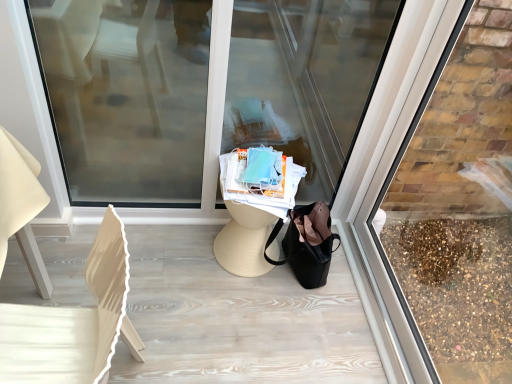
What do you see at coordinates (201, 90) in the screenshot? The image size is (512, 384). I see `transparent glass shop window at center, marked as the 1th shop window in a left-to-right arrangement` at bounding box center [201, 90].

This screenshot has width=512, height=384. What do you see at coordinates (458, 205) in the screenshot? I see `transparent glass at right, which ranks as the 2th shop window in left-to-right order` at bounding box center [458, 205].

You are a GUI agent. You are given a task and a screenshot of the screen. Output one action in this format:
    pyautogui.click(x=<x>, y=<y>)
    Task: Click on the white wood chair at left
    The height and width of the screenshot is (384, 512).
    Given the screenshot: What is the action you would take?
    73,323

This screenshot has width=512, height=384. I want to click on transparent glass shop window at center, marked as the 1th shop window in a left-to-right arrangement, so click(x=201, y=90).

Is transparent glass at right, the first shop window in the right-to-left sequence, looking in the opposite direction of transparent glass shop window at center, the second shop window positioned from the right?

No, transparent glass at right, the first shop window in the right-to-left sequence,'s orientation is not away from transparent glass shop window at center, the second shop window positioned from the right.

Who is bigger, transparent glass at right, the first shop window in the right-to-left sequence, or transparent glass shop window at center, marked as the 1th shop window in a left-to-right arrangement?

transparent glass shop window at center, marked as the 1th shop window in a left-to-right arrangement, is bigger.

Is transparent glass at right, the first shop window in the right-to-left sequence, positioned in front of transparent glass shop window at center, marked as the 1th shop window in a left-to-right arrangement?

Yes, it is.

Considering the positions of point (64, 164) and point (21, 366), is point (64, 164) closer or farther from the camera than point (21, 366)?

Point (64, 164) appears to be farther away from the viewer than point (21, 366).

From the image's perspective, between transparent glass shop window at center, the second shop window positioned from the right, and white wood chair at left, which one is located above?

transparent glass shop window at center, the second shop window positioned from the right, is shown above in the image.

How far apart are transparent glass shop window at center, the second shop window positioned from the right, and white wood chair at left?

37.97 inches.

How different are the orientations of transparent glass shop window at center, the second shop window positioned from the right, and white wood chair at left in degrees?

The angular difference between transparent glass shop window at center, the second shop window positioned from the right, and white wood chair at left is 90.1 degrees.

From their relative heights in the image, would you say white wood chair at left is taller or shorter than transparent glass shop window at center, the second shop window positioned from the right?

white wood chair at left is shorter than transparent glass shop window at center, the second shop window positioned from the right.

Is white wood chair at left next to transparent glass shop window at center, marked as the 1th shop window in a left-to-right arrangement, and touching it?

white wood chair at left is not next to transparent glass shop window at center, marked as the 1th shop window in a left-to-right arrangement, and they're not touching.

How different are the orientations of white wood chair at left and transparent glass shop window at center, marked as the 1th shop window in a left-to-right arrangement, in degrees?

They differ by 90.1 degrees in their facing directions.

Which object is positioned more to the left, transparent glass shop window at center, marked as the 1th shop window in a left-to-right arrangement, or transparent glass at right, which ranks as the 2th shop window in left-to-right order?

Positioned to the left is transparent glass shop window at center, marked as the 1th shop window in a left-to-right arrangement.

How many degrees apart are the facing directions of transparent glass shop window at center, marked as the 1th shop window in a left-to-right arrangement, and transparent glass at right, which ranks as the 2th shop window in left-to-right order?

The angle between the facing direction of transparent glass shop window at center, marked as the 1th shop window in a left-to-right arrangement, and the facing direction of transparent glass at right, which ranks as the 2th shop window in left-to-right order, is 89.5 degrees.

From a real-world perspective, is transparent glass shop window at center, marked as the 1th shop window in a left-to-right arrangement, on transparent glass at right, which ranks as the 2th shop window in left-to-right order?

Incorrect, from a real-world perspective, transparent glass shop window at center, marked as the 1th shop window in a left-to-right arrangement, is lower than transparent glass at right, which ranks as the 2th shop window in left-to-right order.

Is transparent glass shop window at center, the second shop window positioned from the right, surrounding transparent glass at right, which ranks as the 2th shop window in left-to-right order?

No, transparent glass at right, which ranks as the 2th shop window in left-to-right order, is not inside transparent glass shop window at center, the second shop window positioned from the right.

Is white wood chair at left surrounding transparent glass at right, the first shop window in the right-to-left sequence?

Definitely not — transparent glass at right, the first shop window in the right-to-left sequence, is not inside white wood chair at left.

Between white wood chair at left and transparent glass at right, the first shop window in the right-to-left sequence, which one is positioned behind?

white wood chair at left is further from the camera.

From the image's perspective, between white wood chair at left and transparent glass at right, the first shop window in the right-to-left sequence, which one is located above?

transparent glass at right, the first shop window in the right-to-left sequence, is shown above in the image.

From a real-world perspective, is white wood chair at left above or below transparent glass at right, which ranks as the 2th shop window in left-to-right order?

From a real-world perspective, white wood chair at left is physically below transparent glass at right, which ranks as the 2th shop window in left-to-right order.

Does transparent glass at right, the first shop window in the right-to-left sequence, have a lesser height compared to white wood chair at left?

No.

How much distance is there between transparent glass at right, which ranks as the 2th shop window in left-to-right order, and white wood chair at left?

transparent glass at right, which ranks as the 2th shop window in left-to-right order, is 5.04 feet away from white wood chair at left.

From the image's perspective, which object appears higher, transparent glass at right, which ranks as the 2th shop window in left-to-right order, or white wood chair at left?

transparent glass at right, which ranks as the 2th shop window in left-to-right order, is shown above in the image.

Where is `shop window in front of the white wood chair at left`? This screenshot has width=512, height=384. shop window in front of the white wood chair at left is located at coordinates (458, 205).

The height and width of the screenshot is (384, 512). Find the location of `shop window beneath the transparent glass at right, which ranks as the 2th shop window in left-to-right order (from a real-world perspective)`. shop window beneath the transparent glass at right, which ranks as the 2th shop window in left-to-right order (from a real-world perspective) is located at coordinates (201, 90).

At what (x,y) coordinates should I click in order to perform the action: click on shop window that is the 1st object to the right of the white wood chair at left, starting at the anchor. Please return your answer as a coordinate pair (x, y). Looking at the image, I should click on (201, 90).

Which object lies nearer to the anchor point white wood chair at left, transparent glass at right, the first shop window in the right-to-left sequence, or transparent glass shop window at center, the second shop window positioned from the right?

transparent glass shop window at center, the second shop window positioned from the right, lies closer to white wood chair at left than the other object.

Looking at the image, which one is located further to transparent glass shop window at center, marked as the 1th shop window in a left-to-right arrangement, transparent glass at right, the first shop window in the right-to-left sequence, or white wood chair at left?

white wood chair at left is further to transparent glass shop window at center, marked as the 1th shop window in a left-to-right arrangement.

Which object lies further to the anchor point transparent glass at right, the first shop window in the right-to-left sequence, white wood chair at left or transparent glass shop window at center, marked as the 1th shop window in a left-to-right arrangement?

white wood chair at left lies further to transparent glass at right, the first shop window in the right-to-left sequence, than the other object.

Which object lies further to the anchor point transparent glass at right, which ranks as the 2th shop window in left-to-right order, transparent glass shop window at center, the second shop window positioned from the right, or white wood chair at left?

Based on the image, white wood chair at left appears to be further to transparent glass at right, which ranks as the 2th shop window in left-to-right order.

Considering their positions, is white wood chair at left positioned further to transparent glass shop window at center, marked as the 1th shop window in a left-to-right arrangement, than transparent glass at right, the first shop window in the right-to-left sequence?

white wood chair at left is positioned further to the anchor transparent glass shop window at center, marked as the 1th shop window in a left-to-right arrangement.

When comparing their distances from white wood chair at left, does transparent glass shop window at center, marked as the 1th shop window in a left-to-right arrangement, or transparent glass at right, the first shop window in the right-to-left sequence, seem further?

transparent glass at right, the first shop window in the right-to-left sequence, lies further to white wood chair at left than the other object.

Image resolution: width=512 pixels, height=384 pixels. In order to click on shop window between white wood chair at left and transparent glass at right, the first shop window in the right-to-left sequence, from left to right in this screenshot , I will do `click(201, 90)`.